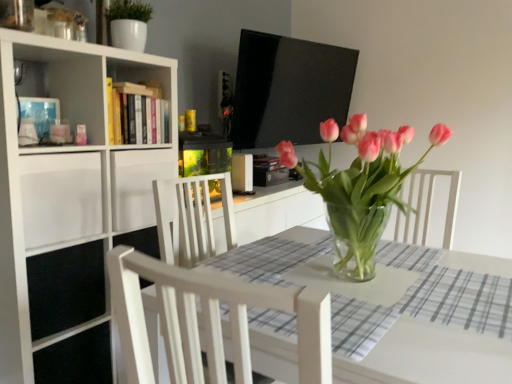
Question: Considering the relative sizes of hardcover book at upper center and white glossy pot at upper left in the image provided, is hardcover book at upper center shorter than white glossy pot at upper left?

Choices:
 (A) no
 (B) yes

Answer: (B)

Question: Is hardcover book at upper center far away from white glossy pot at upper left?

Choices:
 (A) no
 (B) yes

Answer: (A)

Question: From the image's perspective, is hardcover book at upper center over white glossy pot at upper left?

Choices:
 (A) no
 (B) yes

Answer: (A)

Question: Can you confirm if hardcover book at upper center is wider than white glossy pot at upper left?

Choices:
 (A) no
 (B) yes

Answer: (A)

Question: Is hardcover book at upper center positioned in front of white glossy pot at upper left?

Choices:
 (A) yes
 (B) no

Answer: (B)

Question: Considering the relative sizes of hardcover book at upper center and white glossy pot at upper left in the image provided, is hardcover book at upper center smaller than white glossy pot at upper left?

Choices:
 (A) yes
 (B) no

Answer: (A)

Question: Would you say white matte bookcase at left contains white matte drawer at left, marked as the 2th drawer in a right-to-left arrangement?

Choices:
 (A) yes
 (B) no

Answer: (A)

Question: Is white matte bookcase at left oriented towards white matte drawer at left, marked as the 2th drawer in a right-to-left arrangement?

Choices:
 (A) no
 (B) yes

Answer: (B)

Question: Would you consider white matte bookcase at left to be distant from white matte drawer at left, marked as the 2th drawer in a right-to-left arrangement?

Choices:
 (A) no
 (B) yes

Answer: (A)

Question: Does white matte bookcase at left touch white matte drawer at left, marked as the 2th drawer in a right-to-left arrangement?

Choices:
 (A) yes
 (B) no

Answer: (B)

Question: From a real-world perspective, is white matte bookcase at left located higher than white matte drawer at left, marked as the 2th drawer in a right-to-left arrangement?

Choices:
 (A) no
 (B) yes

Answer: (A)

Question: Is white matte bookcase at left shorter than white matte drawer at left, marked as the 2th drawer in a right-to-left arrangement?

Choices:
 (A) no
 (B) yes

Answer: (A)

Question: Is hardcover book at upper center oriented towards white matte drawer at left, which is the 1th drawer in right-to-left order?

Choices:
 (A) no
 (B) yes

Answer: (A)